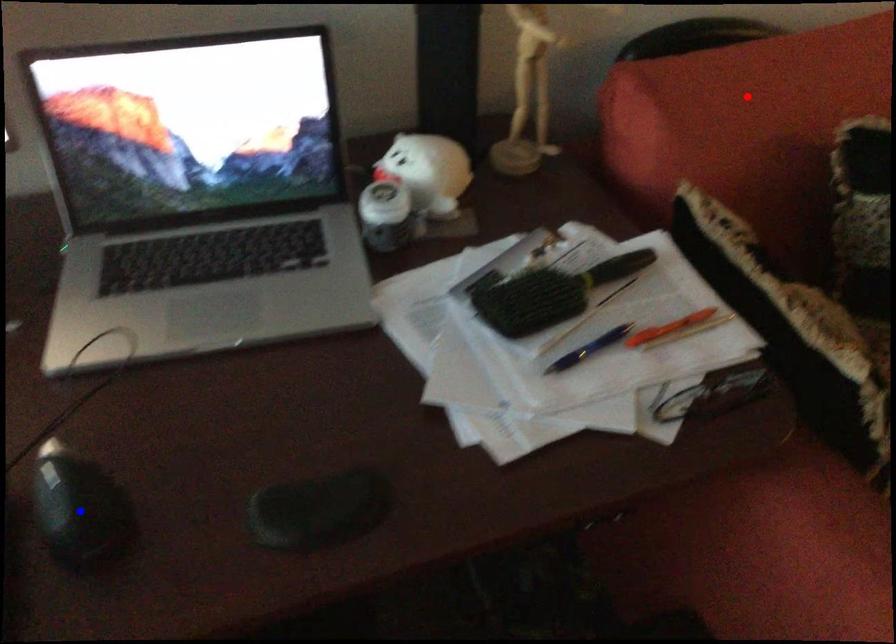
Question: Two points are marked on the image. Which point is closer to the camera?

Choices:
 (A) Blue point is closer.
 (B) Red point is closer.

Answer: (A)